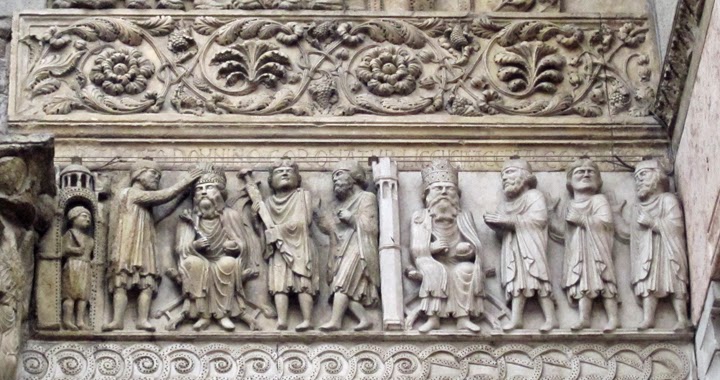
The height and width of the screenshot is (380, 720). What are the coordinates of `wall` in the screenshot? It's located at (451, 207).